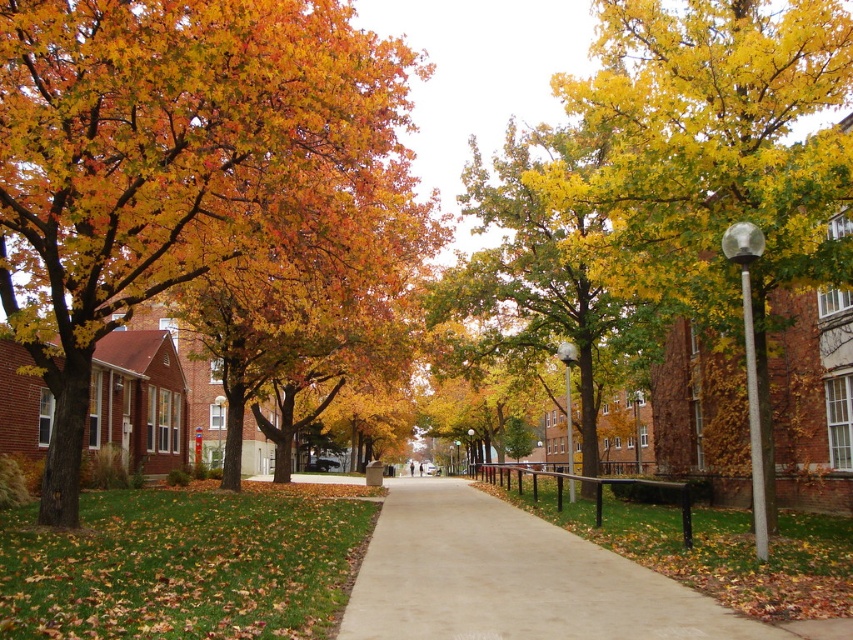
Is yellow/golden leaves at center to the left of yellow-green leafy tree at center from the viewer's perspective?

In fact, yellow/golden leaves at center is to the right of yellow-green leafy tree at center.

Based on the photo, is yellow/golden leaves at center smaller than yellow-green leafy tree at center?

Correct, yellow/golden leaves at center occupies less space than yellow-green leafy tree at center.

What do you see at coordinates (717, 166) in the screenshot? I see `yellow/golden leaves at center` at bounding box center [717, 166].

Identify the location of yellow/golden leaves at center. (717, 166).

Does orange leafy tree at left appear on the left side of smooth concrete sidewalk at center?

Indeed, orange leafy tree at left is positioned on the left side of smooth concrete sidewalk at center.

Which is below, orange leafy tree at left or smooth concrete sidewalk at center?

smooth concrete sidewalk at center

Between point (338, 97) and point (498, 612), which one is positioned behind?

Positioned behind is point (338, 97).

At what (x,y) coordinates should I click in order to perform the action: click on orange leafy tree at left. Please return your answer as a coordinate pair (x, y). Image resolution: width=853 pixels, height=640 pixels. Looking at the image, I should click on (155, 157).

Is yellow/golden leaves at center below smooth concrete sidewalk at center?

No.

Does yellow/golden leaves at center have a greater height compared to smooth concrete sidewalk at center?

Yes.

The height and width of the screenshot is (640, 853). Describe the element at coordinates (717, 166) in the screenshot. I see `yellow/golden leaves at center` at that location.

At what (x,y) coordinates should I click in order to perform the action: click on yellow/golden leaves at center. Please return your answer as a coordinate pair (x, y). This screenshot has height=640, width=853. Looking at the image, I should click on click(717, 166).